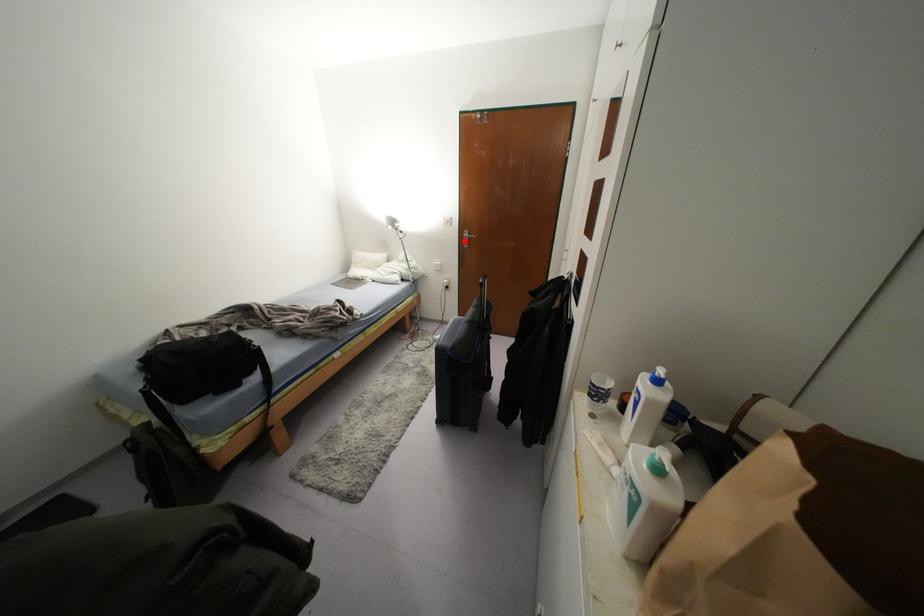
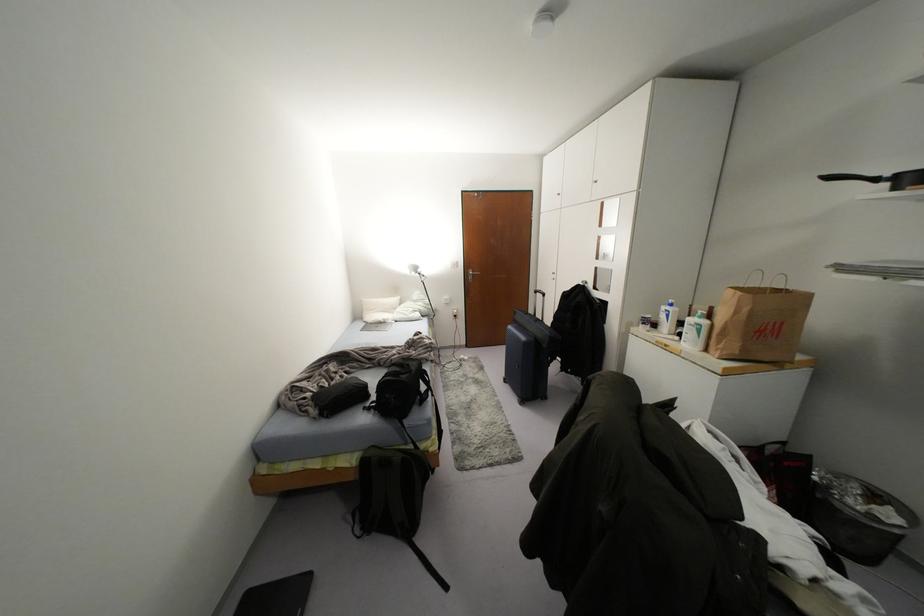
Locate, in the second image, the point that corresponds to the highlighted location in the first image.

(469, 277)